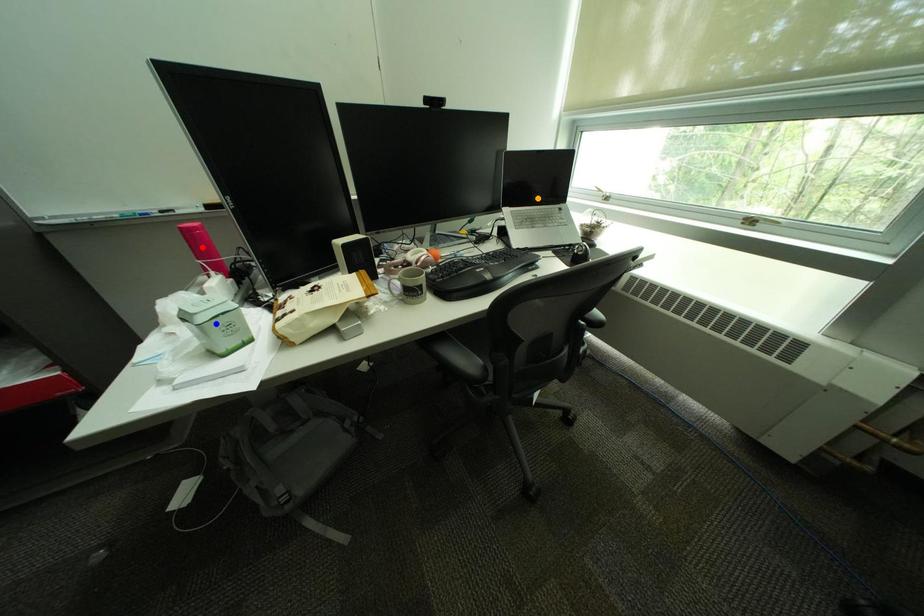
Order these from nearest to farthest:
red point | orange point | blue point

blue point → red point → orange point